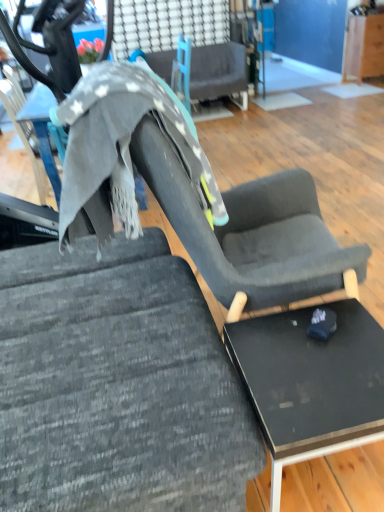
I want to click on black glossy table at lower right, so click(311, 382).

What do you see at coordinates (219, 73) in the screenshot? I see `textured gray fabric chair at center, which is counted as the 1th chair, starting from the back` at bounding box center [219, 73].

What are the coordinates of `black glossy table at lower right` in the screenshot? It's located at (311, 382).

Considering the relative sizes of textured gray fabric at center, the first chair viewed from the front, and black glossy table at lower right in the image provided, is textured gray fabric at center, the first chair viewed from the front, bigger than black glossy table at lower right?

Yes, textured gray fabric at center, the first chair viewed from the front, is bigger than black glossy table at lower right.

Are textured gray fabric at center, placed as the 1th chair when sorted from bottom to top, and black glossy table at lower right far apart?

No.

Is point (86, 342) closer to viewer compared to point (316, 453)?

No, (86, 342) is further to viewer.

Based on the photo, between textured gray fabric at center, the first chair viewed from the front, and black glossy table at lower right, which one is positioned behind?

black glossy table at lower right is further from the camera.

The width and height of the screenshot is (384, 512). In order to click on chair that appears on the left of textured gray fabric chair at center, which appears as the 2th chair when ordered from the bottom in this screenshot , I will do `click(117, 384)`.

Is textured gray fabric at center, the first chair viewed from the front, inside the boundaries of textured gray fabric chair at center, the 2th chair positioned from the front, or outside?

textured gray fabric at center, the first chair viewed from the front, is not enclosed by textured gray fabric chair at center, the 2th chair positioned from the front.

In terms of width, does textured gray fabric at center, which is the 2th chair in back-to-front order, look wider or thinner when compared to textured gray fabric chair at center, the 2th chair positioned from the front?

textured gray fabric at center, which is the 2th chair in back-to-front order, is wider than textured gray fabric chair at center, the 2th chair positioned from the front.

Looking at this image, looking at their sizes, would you say textured gray fabric chair at center, which is counted as the 1th chair, starting from the back, is wider or thinner than black glossy table at lower right?

Considering their sizes, textured gray fabric chair at center, which is counted as the 1th chair, starting from the back, looks broader than black glossy table at lower right.

Is point (242, 105) in front of point (361, 364)?

No, it is behind (361, 364).

From the image's perspective, is textured gray fabric chair at center, which is counted as the 1th chair, starting from the back, located above black glossy table at lower right?

Yes.

Looking at this image, considering the sizes of textured gray fabric chair at center, marked as the first chair in a top-to-bottom arrangement, and black glossy table at lower right in the image, is textured gray fabric chair at center, marked as the first chair in a top-to-bottom arrangement, taller or shorter than black glossy table at lower right?

textured gray fabric chair at center, marked as the first chair in a top-to-bottom arrangement, is taller than black glossy table at lower right.

Is black glossy table at lower right facing towards textured gray fabric at center, which is the 2th chair in back-to-front order?

No, black glossy table at lower right is not oriented towards textured gray fabric at center, which is the 2th chair in back-to-front order.

From a real-world perspective, is black glossy table at lower right over textured gray fabric at center, placed as the 1th chair when sorted from bottom to top?

No.

Can you confirm if black glossy table at lower right is bigger than textured gray fabric at center, the first chair viewed from the front?

No, black glossy table at lower right is not bigger than textured gray fabric at center, the first chair viewed from the front.

From the picture: Can you confirm if textured gray fabric chair at center, the 2th chair positioned from the front, is wider than textured gray fabric at center, the second chair in the top-to-bottom sequence?

No.

Which is more distant, (227, 82) or (65, 277)?

The point (227, 82) is more distant.

Considering the sizes of objects textured gray fabric chair at center, which is counted as the 1th chair, starting from the back, and textured gray fabric at center, which is the 2th chair in back-to-front order, in the image provided, who is taller, textured gray fabric chair at center, which is counted as the 1th chair, starting from the back, or textured gray fabric at center, which is the 2th chair in back-to-front order,?

textured gray fabric at center, which is the 2th chair in back-to-front order.

The image size is (384, 512). I want to click on chair behind the textured gray fabric at center, the first chair viewed from the front, so click(219, 73).

Considering the positions of objects black glossy table at lower right and textured gray fabric chair at center, which appears as the 2th chair when ordered from the bottom, in the image provided, who is behind, black glossy table at lower right or textured gray fabric chair at center, which appears as the 2th chair when ordered from the bottom,?

textured gray fabric chair at center, which appears as the 2th chair when ordered from the bottom.

Does black glossy table at lower right have a smaller size compared to textured gray fabric chair at center, marked as the first chair in a top-to-bottom arrangement?

Indeed, black glossy table at lower right has a smaller size compared to textured gray fabric chair at center, marked as the first chair in a top-to-bottom arrangement.

Is black glossy table at lower right looking in the opposite direction of textured gray fabric chair at center, which is counted as the 1th chair, starting from the back?

No.

How many degrees apart are the facing directions of black glossy table at lower right and textured gray fabric chair at center, which appears as the 2th chair when ordered from the bottom?

The facing directions of black glossy table at lower right and textured gray fabric chair at center, which appears as the 2th chair when ordered from the bottom, are 179 degrees apart.

There is a black glossy table at lower right. Identify the location of the 2nd chair above it (from a real-world perspective). (117, 384).

Where is `chair above the textured gray fabric at center, the first chair viewed from the front (from the image's perspective)`? Image resolution: width=384 pixels, height=512 pixels. chair above the textured gray fabric at center, the first chair viewed from the front (from the image's perspective) is located at coordinates (219, 73).

From the image, which object appears to be farther from textured gray fabric at center, the second chair in the top-to-bottom sequence, textured gray fabric chair at center, which appears as the 2th chair when ordered from the bottom, or black glossy table at lower right?

The object further to textured gray fabric at center, the second chair in the top-to-bottom sequence, is textured gray fabric chair at center, which appears as the 2th chair when ordered from the bottom.

From the image, which object appears to be nearer to textured gray fabric chair at center, which is counted as the 1th chair, starting from the back, textured gray fabric at center, which is the 2th chair in back-to-front order, or black glossy table at lower right?

The object closer to textured gray fabric chair at center, which is counted as the 1th chair, starting from the back, is textured gray fabric at center, which is the 2th chair in back-to-front order.

From the image, which object appears to be farther from black glossy table at lower right, textured gray fabric chair at center, marked as the first chair in a top-to-bottom arrangement, or textured gray fabric at center, placed as the 1th chair when sorted from bottom to top?

textured gray fabric chair at center, marked as the first chair in a top-to-bottom arrangement, is positioned further to the anchor black glossy table at lower right.

Which object lies further to the anchor point black glossy table at lower right, textured gray fabric at center, placed as the 1th chair when sorted from bottom to top, or textured gray fabric chair at center, the 2th chair positioned from the front?

textured gray fabric chair at center, the 2th chair positioned from the front, is further to black glossy table at lower right.

When comparing their distances from textured gray fabric at center, which is the 2th chair in back-to-front order, does black glossy table at lower right or textured gray fabric chair at center, the 2th chair positioned from the front, seem further?

textured gray fabric chair at center, the 2th chair positioned from the front, is further to textured gray fabric at center, which is the 2th chair in back-to-front order.

Considering their positions, is black glossy table at lower right positioned closer to textured gray fabric chair at center, the 2th chair positioned from the front, than textured gray fabric at center, placed as the 1th chair when sorted from bottom to top?

textured gray fabric at center, placed as the 1th chair when sorted from bottom to top, is positioned closer to the anchor textured gray fabric chair at center, the 2th chair positioned from the front.

At what (x,y) coordinates should I click in order to perform the action: click on table between textured gray fabric at center, the second chair in the top-to-bottom sequence, and textured gray fabric chair at center, which is counted as the 1th chair, starting from the back, along the z-axis. Please return your answer as a coordinate pair (x, y). This screenshot has height=512, width=384. Looking at the image, I should click on (311, 382).